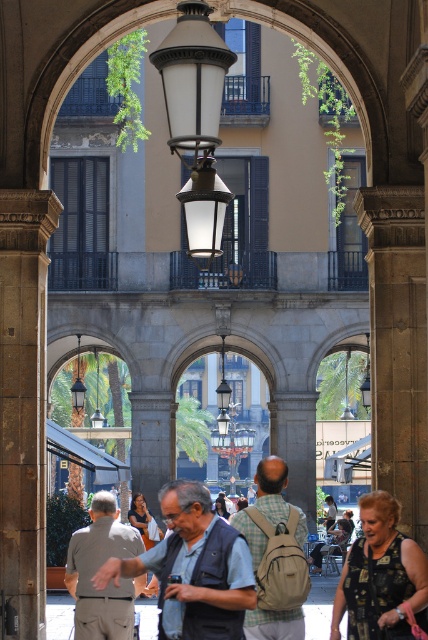
Consider the image. You are standing in the arched passageway and want to determine which of the two points, point (x=180, y=552) or point (x=216, y=432), is nearer to you. Based on the scene, which point is closer?

Point (x=180, y=552) is closer to the viewer than point (x=216, y=432).

You are a tailor standing at the entrance of the arched passageway, and you need to locate the gray fabric vest at center. According to the coordinate system where the bottom left corner is the origin, where would you find it?

The gray fabric vest at center is located at coordinate point (195, 566).